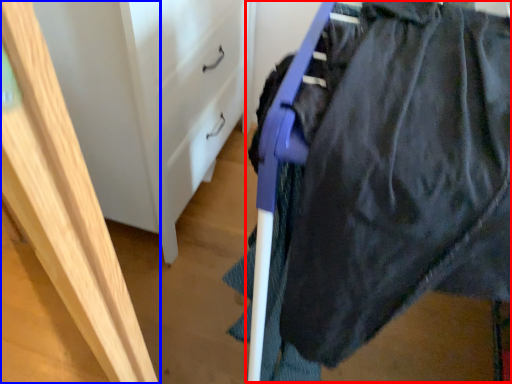
Question: Among these objects, which one is nearest to the camera, wide (highlighted by a red box) or furniture (highlighted by a blue box)?

Choices:
 (A) wide
 (B) furniture

Answer: (B)